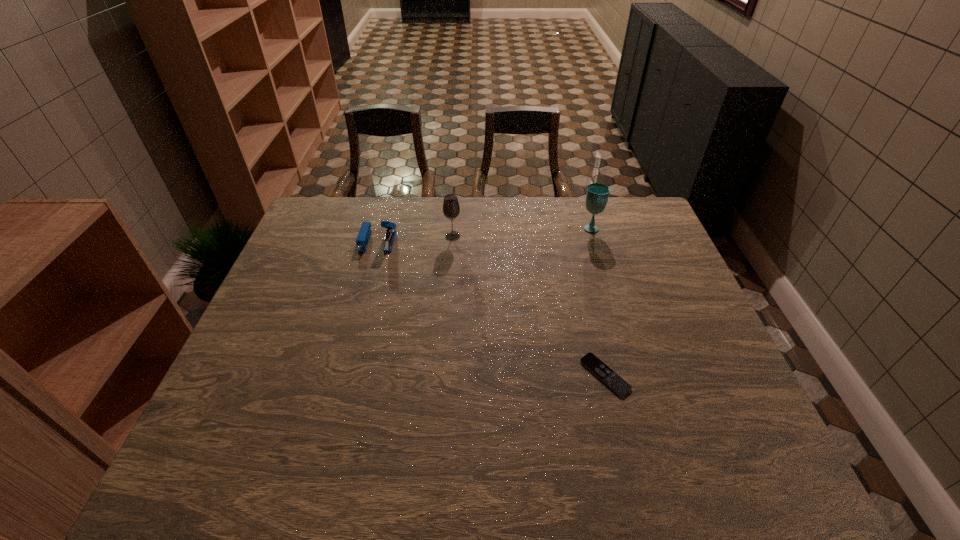
The image size is (960, 540). I want to click on stapler located at the far edge, so click(364, 234).

The width and height of the screenshot is (960, 540). What are the coordinates of `free region at the far edge of the desktop` in the screenshot? It's located at (515, 200).

This screenshot has height=540, width=960. In the image, there is a desktop. What are the coordinates of `vacant space at the near edge` in the screenshot? It's located at (627, 441).

At what (x,y) coordinates should I click in order to perform the action: click on free space at the left edge of the desktop. Please return your answer as a coordinate pair (x, y). This screenshot has width=960, height=540. Looking at the image, I should click on (220, 388).

Locate an element on the screen. vacant area at the right edge is located at coordinates (646, 279).

This screenshot has height=540, width=960. In the image, there is a desktop. Identify the location of vacant space at the far right corner. (625, 215).

Find the location of a particular element. free space that is in between the nearest object and the right glass drink container is located at coordinates (598, 301).

Locate an element on the screen. unoccupied position between the right glass drink container and the left glass drink container is located at coordinates (522, 232).

Find the location of `free space between the left glass drink container and the right glass drink container`. free space between the left glass drink container and the right glass drink container is located at coordinates (522, 232).

Where is `unoccupied area between the stapler and the right glass drink container`? unoccupied area between the stapler and the right glass drink container is located at coordinates (485, 234).